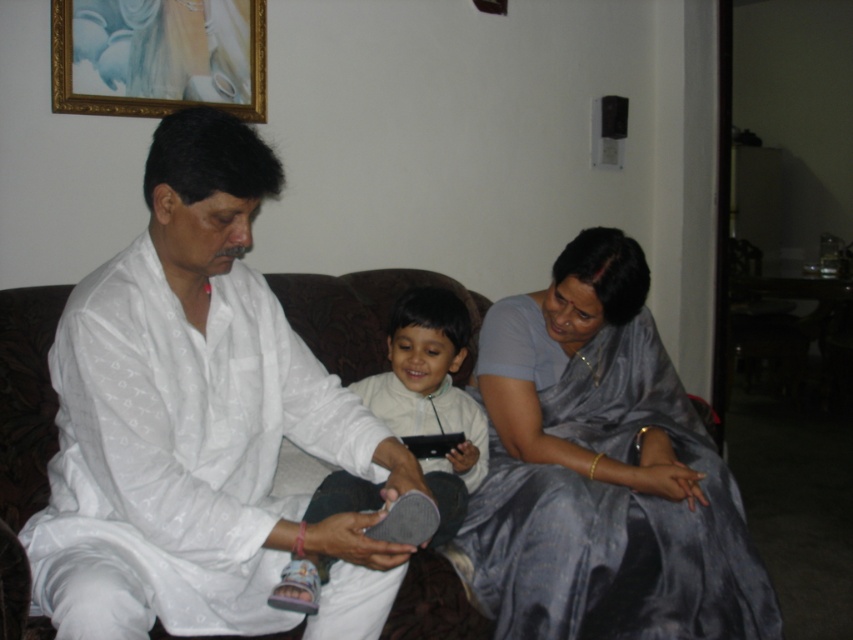
In the living room scene, there is a white cotton kurta at center and a silky blue saree at lower right. Which clothing item is positioned to the left of the other?

The white cotton kurta at center is to the left of silky blue saree at lower right.

You are designing a new seating arrangement for a living room. You have to place the white cotton kurta at center and the silky blue saree at lower right. Considering their widths, which one requires more space horizontally?

The silky blue saree at lower right requires more horizontal space because it has a greater width than the white cotton kurta at center.